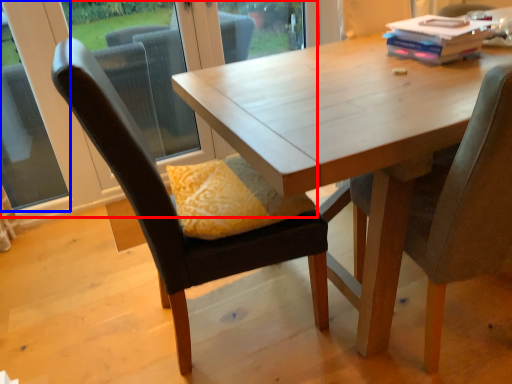
Question: Which object appears closest to the camera in this image, window frame (highlighted by a red box) or window (highlighted by a blue box)?

Choices:
 (A) window frame
 (B) window

Answer: (B)